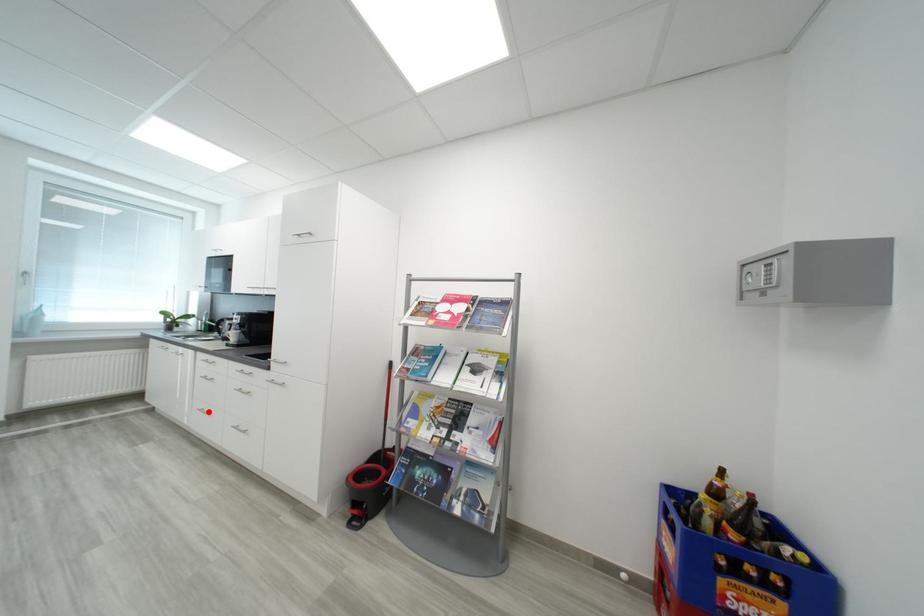
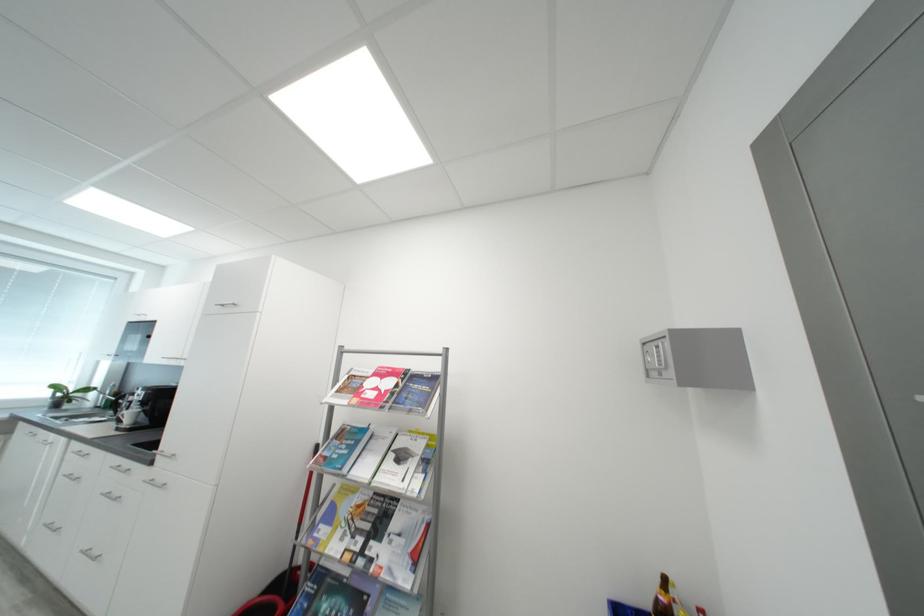
The point at the highlighted location is marked in the first image. Where is the corresponding point in the second image?

(56, 527)